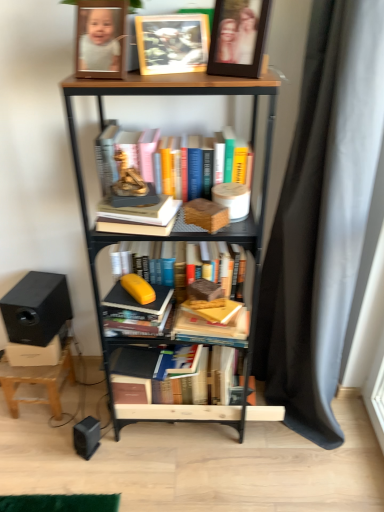
This screenshot has width=384, height=512. Find the location of `unoccupied region to the right of black plastic speaker at lower left, the first speaker in the right-to-left sequence`. unoccupied region to the right of black plastic speaker at lower left, the first speaker in the right-to-left sequence is located at coordinates (134, 450).